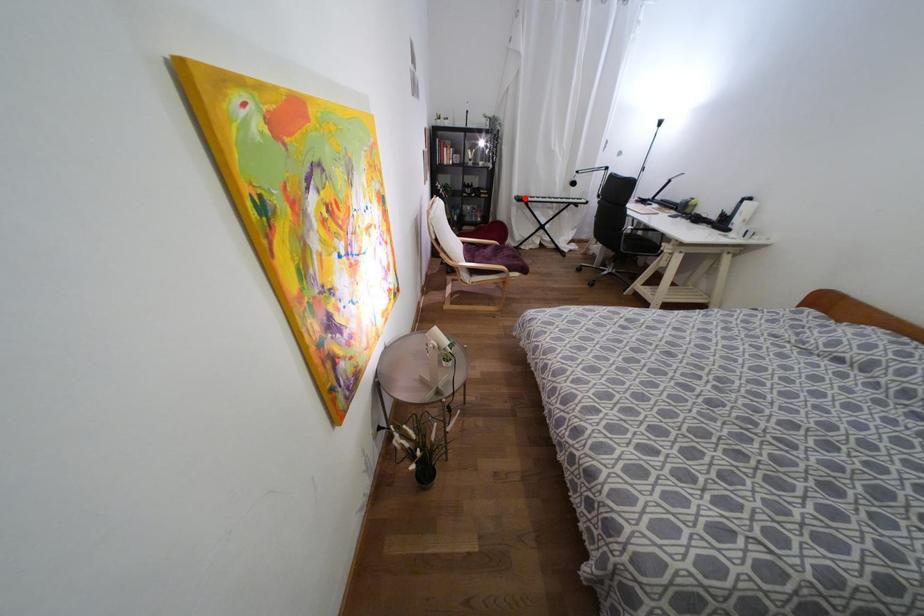
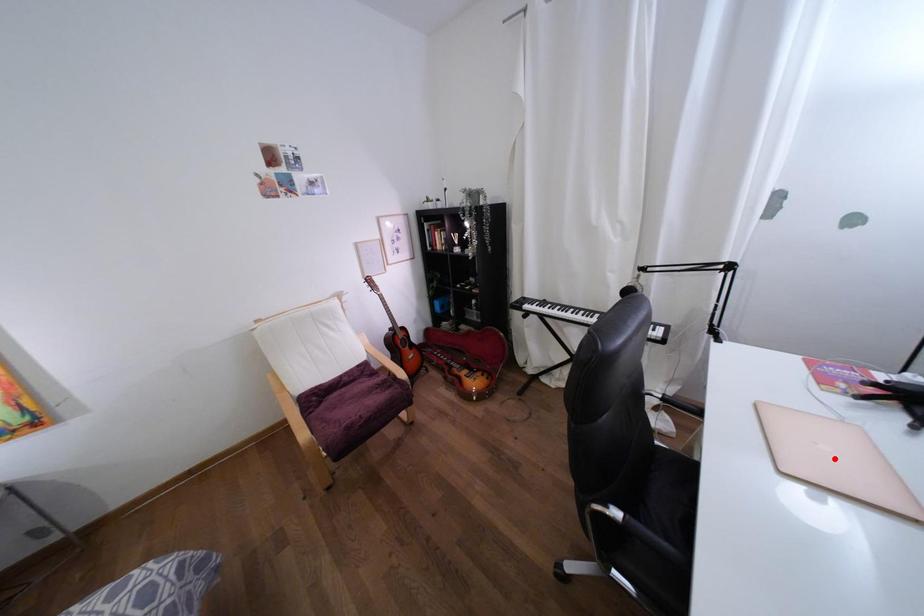
I am providing you with two images of the same scene from different viewpoints. A red point is marked on the first image and another point is marked on the second image. Does the point marked in image1 correspond to the same location as the one in image2?

No